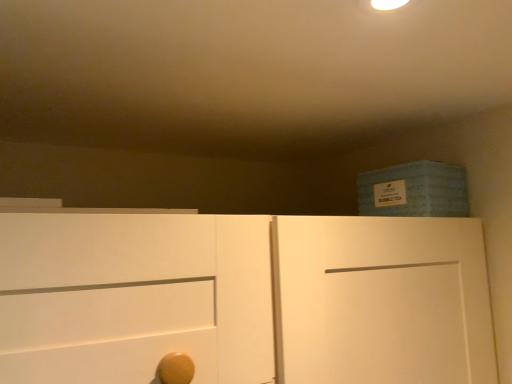
This screenshot has width=512, height=384. Describe the element at coordinates (414, 190) in the screenshot. I see `teal fabric box at upper right` at that location.

Locate an element on the screen. teal fabric box at upper right is located at coordinates (414, 190).

I want to click on teal fabric box at upper right, so click(414, 190).